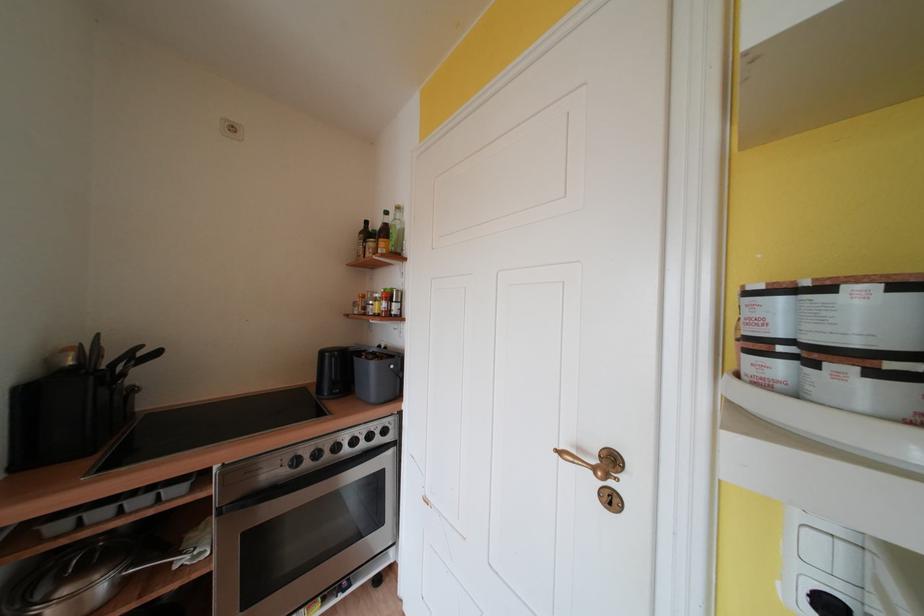
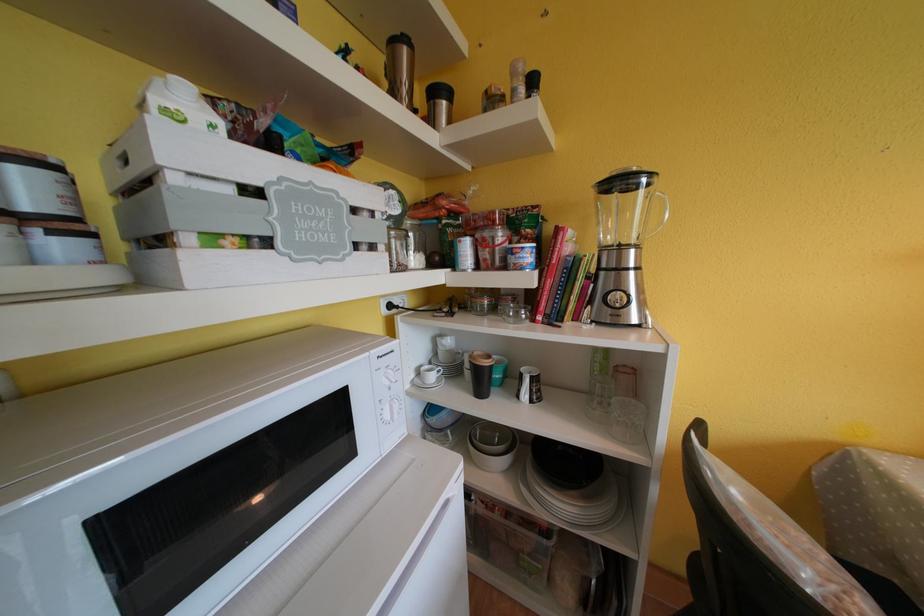
Question: The first image is from the beginning of the video and the second image is from the end. How did the camera likely rotate when shooting the video?

Choices:
 (A) Left
 (B) Right
 (C) Up
 (D) Down

Answer: (B)